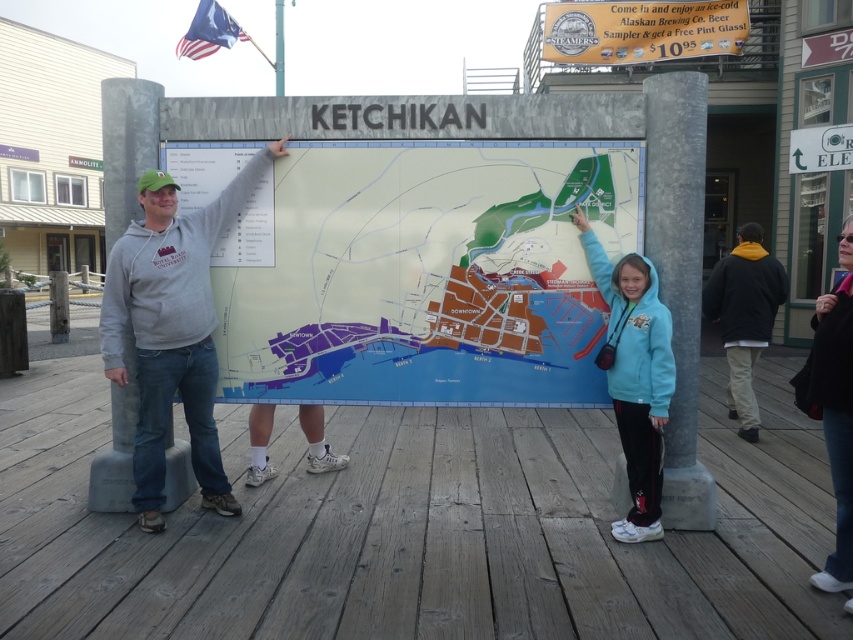
Is tweety blue hoodie at upper right above denim jacket at lower right?

Indeed, tweety blue hoodie at upper right is positioned over denim jacket at lower right.

Which is in front, point (660, 403) or point (839, 294)?

Point (839, 294)

The image size is (853, 640). I want to click on tweety blue hoodie at upper right, so click(635, 376).

Does matte plastic map at center lie in front of white plastic sign at upper right?

Yes.

Identify the location of matte plastic map at center. The width and height of the screenshot is (853, 640). (422, 273).

In the scene shown: Is metallic gold sign at upper center above american flag at upper left?

No, metallic gold sign at upper center is not above american flag at upper left.

Does metallic gold sign at upper center appear on the right side of american flag at upper left?

Indeed, metallic gold sign at upper center is positioned on the right side of american flag at upper left.

Is point (631, 60) closer to camera compared to point (230, 42)?

Yes, point (631, 60) is closer to viewer.

The width and height of the screenshot is (853, 640). Identify the location of metallic gold sign at upper center. (642, 29).